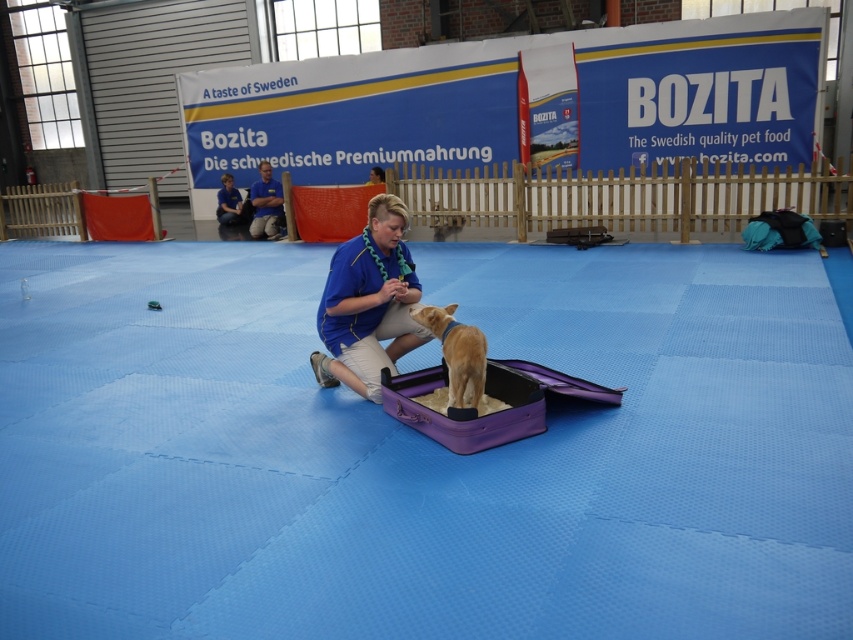
Is golden fur dog at center closer to camera compared to blue shirt at center?

Yes.

Is point (463, 387) in front of point (273, 202)?

Yes.

Is point (468, 348) in front of point (267, 188)?

Yes, it is in front of point (267, 188).

Locate an element on the screen. The width and height of the screenshot is (853, 640). golden fur dog at center is located at coordinates (457, 353).

Does blue fabric squat at center have a larger size compared to blue shirt at center?

Yes, blue fabric squat at center is bigger than blue shirt at center.

Who is more forward, (347, 289) or (262, 234)?

Point (347, 289) is more forward.

Where is `blue fabric squat at center`? The image size is (853, 640). blue fabric squat at center is located at coordinates (368, 301).

Does blue fabric squat at center have a larger size compared to golden fur dog at center?

Yes.

You are a GUI agent. You are given a task and a screenshot of the screen. Output one action in this format:
    pyautogui.click(x=<x>, y=<y>)
    Task: Click on the blue fabric squat at center
    The width and height of the screenshot is (853, 640).
    Given the screenshot: What is the action you would take?
    pyautogui.click(x=368, y=301)

Where is `blue fabric squat at center`? The height and width of the screenshot is (640, 853). blue fabric squat at center is located at coordinates (368, 301).